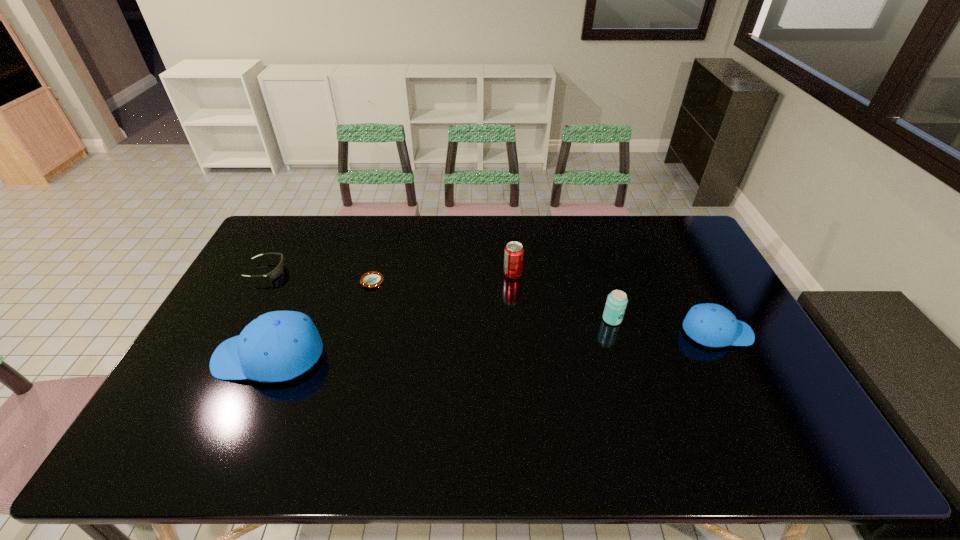
Where is `the taller cap`? This screenshot has width=960, height=540. the taller cap is located at coordinates (277, 346).

At what (x,y) coordinates should I click in order to perform the action: click on the tallest object. Please return your answer as a coordinate pair (x, y). Looking at the image, I should click on [277, 346].

Where is `the right cap`? Image resolution: width=960 pixels, height=540 pixels. the right cap is located at coordinates (712, 325).

At what (x,y) coordinates should I click in order to perform the action: click on the rightmost object. Please return your answer as a coordinate pair (x, y). The image size is (960, 540). Looking at the image, I should click on coord(712,325).

Where is `goggles`? goggles is located at coordinates (278, 270).

Identify the location of the shortest object. Image resolution: width=960 pixels, height=540 pixels. (373, 279).

At what (x,y) coordinates should I click in order to perform the action: click on compass. Please return your answer as a coordinate pair (x, y). Looking at the image, I should click on (373, 279).

I want to click on beer can, so click(x=617, y=300).

The image size is (960, 540). Find the location of `the fifth shortest object`. the fifth shortest object is located at coordinates (513, 254).

At what (x,y) coordinates should I click in order to perform the action: click on the third object from right to left. Please return your answer as a coordinate pair (x, y). This screenshot has height=540, width=960. Looking at the image, I should click on (513, 254).